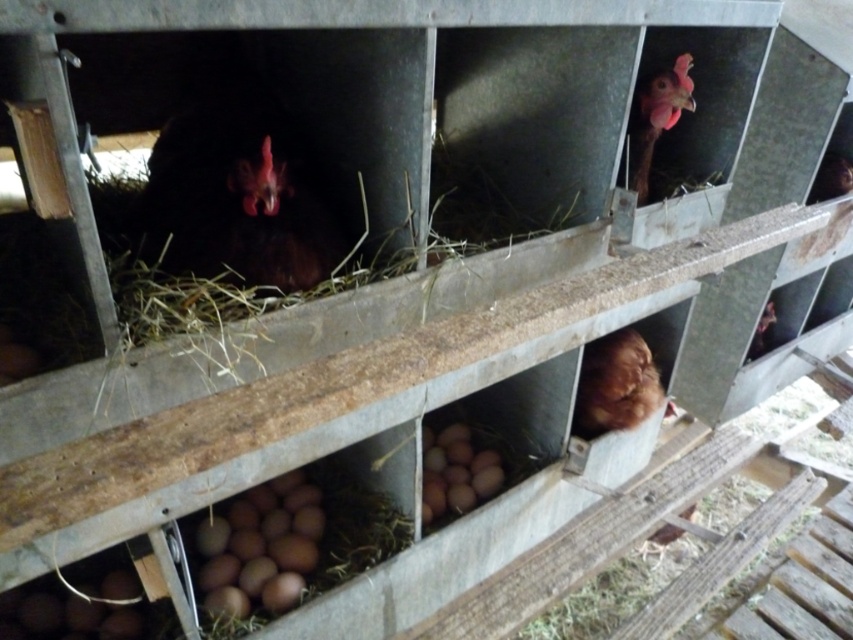
You are a farmer checking the nesting boxes in the chicken coop. You see the black matte chicken at center and the pink matte chicken at upper right. Which chicken is located to the left of the other?

The black matte chicken at center is positioned on the left side of pink matte chicken at upper right.

You are a farmer checking the chicken coop. You need to collect the brown matte eggs at center without disturbing the brown fluffy chicken at lower center. What is the minimum distance you should maintain between yourself and the chicken while reaching for the eggs?

The brown matte eggs at center and brown fluffy chicken at lower center are 26.18 inches apart from each other. To collect the eggs without disturbing the chicken, you should maintain a minimum distance of at least 26.18 inches between yourself and the brown fluffy chicken at lower center.